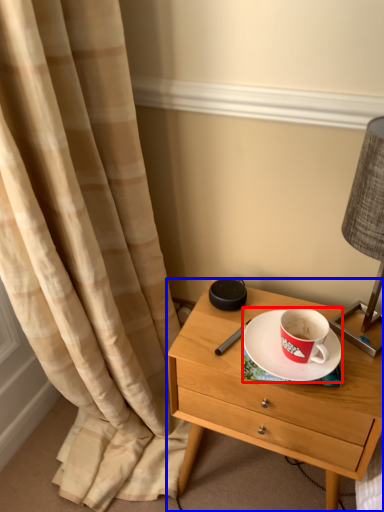
Question: Which point is further to the camera, saucer (highlighted by a red box) or nightstand (highlighted by a blue box)?

Choices:
 (A) saucer
 (B) nightstand

Answer: (A)